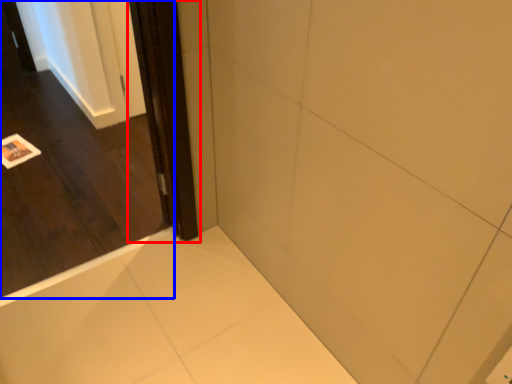
Question: Among these objects, which one is farthest to the camera, screen door (highlighted by a red box) or door (highlighted by a blue box)?

Choices:
 (A) screen door
 (B) door

Answer: (A)